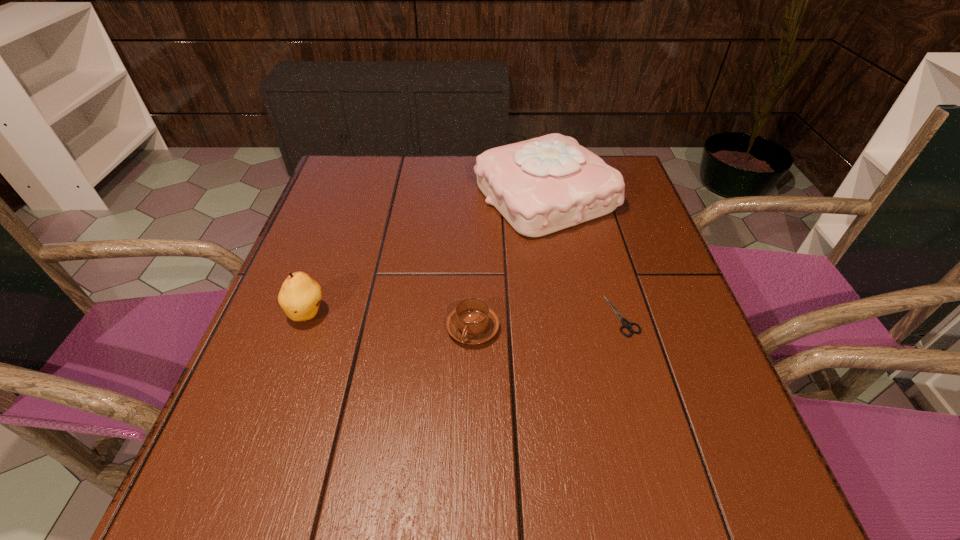
The height and width of the screenshot is (540, 960). I want to click on the farthest object, so tap(540, 186).

Locate an element on the screen. This screenshot has width=960, height=540. the tallest object is located at coordinates (540, 186).

Identify the location of the leftmost object. This screenshot has height=540, width=960. (300, 296).

Identify the location of the second tallest object. (300, 296).

You are a GUI agent. You are given a task and a screenshot of the screen. Output one action in this format:
    pyautogui.click(x=<x>, y=<y>)
    Task: Click on the third tallest object
    Image resolution: width=960 pixels, height=540 pixels.
    Given the screenshot: What is the action you would take?
    pyautogui.click(x=472, y=322)

Find the location of `shears`. shears is located at coordinates (626, 324).

At what (x,y) coordinates should I click in order to perform the action: click on vacant area situated 0.240m on the left of the tallest object. Please return your answer as a coordinate pair (x, y). The image size is (960, 540). Looking at the image, I should click on (383, 197).

Identify the location of vacant space located 0.100m on the front of the pear. The height and width of the screenshot is (540, 960). (286, 374).

You are a GUI agent. You are given a task and a screenshot of the screen. Output one action in this format:
    pyautogui.click(x=<x>, y=<y>)
    Task: Click on the free location located 0.270m on the side of the cappuccino with the handle
    The image size is (960, 540).
    Given the screenshot: What is the action you would take?
    pyautogui.click(x=470, y=504)

Locate an element on the screen. The width and height of the screenshot is (960, 540). free space located on the back of the shortest object is located at coordinates (590, 206).